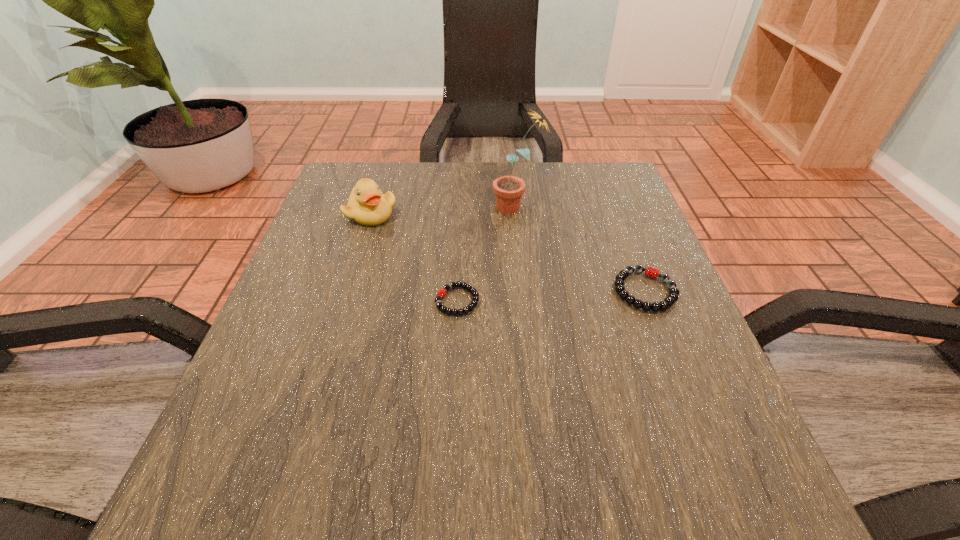
In the image, there is a desktop. Where is `free region at the left edge`? The image size is (960, 540). free region at the left edge is located at coordinates (323, 327).

Where is `free space at the right edge of the desktop`? free space at the right edge of the desktop is located at coordinates (714, 459).

Where is `free space at the far left corner`? This screenshot has height=540, width=960. free space at the far left corner is located at coordinates (334, 184).

Locate an element on the screen. The width and height of the screenshot is (960, 540). vacant space at the near left corner is located at coordinates (293, 479).

In the image, there is a desktop. Identify the location of free region at the far right corner. (618, 198).

Find the location of a particular element. The image size is (960, 540). vacant space at the near right corner is located at coordinates coord(678,471).

I want to click on vacant area that lies between the taller bracelet and the third object from right to left, so click(551, 296).

Where is `vacant space in between the second object from right to left and the rightmost object`? vacant space in between the second object from right to left and the rightmost object is located at coordinates (581, 249).

The height and width of the screenshot is (540, 960). What are the coordinates of `free spot between the shorter bracelet and the sunflower` in the screenshot? It's located at (487, 254).

Locate an element on the screen. unoccupied area between the second object from left to right and the right bracelet is located at coordinates (551, 296).